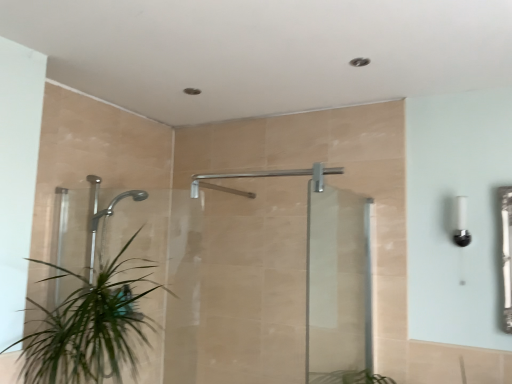
Locate an element on the screen. The width and height of the screenshot is (512, 384). transparent glass shower door at center, which ranks as the 2th screen door in right-to-left order is located at coordinates (268, 283).

Image resolution: width=512 pixels, height=384 pixels. Describe the element at coordinates (90, 327) in the screenshot. I see `green leafy plant at lower left` at that location.

I want to click on transparent glass screen door at center, arranged as the first screen door when viewed from the right, so click(338, 285).

Identify the location of white glossy light fixture at right. The image size is (512, 384). (461, 223).

Identify the location of houseplant below the transparent glass shower door at center, the first screen door from the left (from a real-world perspective). This screenshot has height=384, width=512. (90, 327).

How different are the orientations of transparent glass shower door at center, the first screen door from the left, and green leafy plant at lower left in degrees?

The angular difference between transparent glass shower door at center, the first screen door from the left, and green leafy plant at lower left is 85.4 degrees.

Are transparent glass shower door at center, which ranks as the 2th screen door in right-to-left order, and green leafy plant at lower left beside each other?

No.

Is silver metallic shower at center directly adjacent to white glossy light fixture at right?

No, silver metallic shower at center is not with white glossy light fixture at right.

You are a GUI agent. You are given a task and a screenshot of the screen. Output one action in this format:
    pyautogui.click(x=<x>, y=<y>)
    Task: Click on the shower above the white glossy light fixture at right (from a real-world perspective)
    This screenshot has height=384, width=512.
    Given the screenshot: What is the action you would take?
    [217, 189]

Is silver metallic shower at center located outside white glossy light fixture at right?

Indeed, silver metallic shower at center is completely outside white glossy light fixture at right.

Considering the sizes of objects silver metallic shower at center and white glossy light fixture at right in the image provided, who is taller, silver metallic shower at center or white glossy light fixture at right?

white glossy light fixture at right is taller.

Would you say white glossy light fixture at right is inside or outside transparent glass screen door at center, acting as the 2th screen door starting from the left?

white glossy light fixture at right is outside transparent glass screen door at center, acting as the 2th screen door starting from the left.

In the scene shown: Considering the sizes of objects white glossy light fixture at right and transparent glass screen door at center, arranged as the first screen door when viewed from the right, in the image provided, who is bigger, white glossy light fixture at right or transparent glass screen door at center, arranged as the first screen door when viewed from the right,?

Bigger between the two is transparent glass screen door at center, arranged as the first screen door when viewed from the right.

Does white glossy light fixture at right appear on the right side of transparent glass screen door at center, acting as the 2th screen door starting from the left?

Correct, you'll find white glossy light fixture at right to the right of transparent glass screen door at center, acting as the 2th screen door starting from the left.

Who is taller, white glossy light fixture at right or transparent glass screen door at center, acting as the 2th screen door starting from the left?

With more height is transparent glass screen door at center, acting as the 2th screen door starting from the left.

In terms of height, does white glossy light fixture at right look taller or shorter compared to transparent glass shower door at center, which ranks as the 2th screen door in right-to-left order?

white glossy light fixture at right is shorter than transparent glass shower door at center, which ranks as the 2th screen door in right-to-left order.

From the image's perspective, is white glossy light fixture at right positioned above or below transparent glass shower door at center, which ranks as the 2th screen door in right-to-left order?

From the image's perspective, white glossy light fixture at right appears above transparent glass shower door at center, which ranks as the 2th screen door in right-to-left order.

Would you consider white glossy light fixture at right to be distant from transparent glass shower door at center, which ranks as the 2th screen door in right-to-left order?

Absolutely, white glossy light fixture at right is distant from transparent glass shower door at center, which ranks as the 2th screen door in right-to-left order.

How much distance is there between white glossy light fixture at right and transparent glass shower door at center, which ranks as the 2th screen door in right-to-left order?

white glossy light fixture at right and transparent glass shower door at center, which ranks as the 2th screen door in right-to-left order, are 3.30 feet apart.

Is green leafy plant at lower left in front of or behind white glossy light fixture at right in the image?

green leafy plant at lower left is positioned closer to the viewer than white glossy light fixture at right.

From the image's perspective, is green leafy plant at lower left above white glossy light fixture at right?

No, from the image's perspective, green leafy plant at lower left is not over white glossy light fixture at right.

Can you confirm if green leafy plant at lower left is bigger than white glossy light fixture at right?

Yes, green leafy plant at lower left is bigger than white glossy light fixture at right.

Is green leafy plant at lower left facing away from white glossy light fixture at right?

No, green leafy plant at lower left's orientation is not away from white glossy light fixture at right.

Is transparent glass shower door at center, the first screen door from the left, not within transparent glass screen door at center, acting as the 2th screen door starting from the left?

Indeed, transparent glass shower door at center, the first screen door from the left, is completely outside transparent glass screen door at center, acting as the 2th screen door starting from the left.

Is transparent glass shower door at center, the first screen door from the left, at the left side of transparent glass screen door at center, arranged as the first screen door when viewed from the right?

Correct, you'll find transparent glass shower door at center, the first screen door from the left, to the left of transparent glass screen door at center, arranged as the first screen door when viewed from the right.

From a real-world perspective, relative to transparent glass screen door at center, acting as the 2th screen door starting from the left, is transparent glass shower door at center, the first screen door from the left, vertically above or below?

transparent glass shower door at center, the first screen door from the left, is above transparent glass screen door at center, acting as the 2th screen door starting from the left.

From the image's perspective, who appears lower, silver metallic shower at center or transparent glass shower door at center, which ranks as the 2th screen door in right-to-left order?

transparent glass shower door at center, which ranks as the 2th screen door in right-to-left order, appears lower in the image.

Is silver metallic shower at center positioned beyond the bounds of transparent glass shower door at center, the first screen door from the left?

Yes, silver metallic shower at center is not within transparent glass shower door at center, the first screen door from the left.

Relative to transparent glass shower door at center, which ranks as the 2th screen door in right-to-left order, is silver metallic shower at center in front or behind?

silver metallic shower at center is behind transparent glass shower door at center, which ranks as the 2th screen door in right-to-left order.

Who is taller, silver metallic shower at center or transparent glass shower door at center, the first screen door from the left?

Standing taller between the two is transparent glass shower door at center, the first screen door from the left.

The width and height of the screenshot is (512, 384). In order to click on houseplant lying on the left of transparent glass shower door at center, which ranks as the 2th screen door in right-to-left order in this screenshot , I will do `click(90, 327)`.

This screenshot has width=512, height=384. I want to click on light fixture lying on the right of silver metallic shower at center, so click(x=461, y=223).

Based on their spatial positions, is silver metallic shower at center or green leafy plant at lower left closer to white glossy light fixture at right?

silver metallic shower at center is closer to white glossy light fixture at right.

Based on their spatial positions, is white glossy light fixture at right or silver metallic shower at center further from transparent glass shower door at center, which ranks as the 2th screen door in right-to-left order?

Among the two, white glossy light fixture at right is located further to transparent glass shower door at center, which ranks as the 2th screen door in right-to-left order.

Based on the photo, looking at the image, which one is located closer to silver metallic shower at center, transparent glass shower door at center, which ranks as the 2th screen door in right-to-left order, or white glossy light fixture at right?

Among the two, transparent glass shower door at center, which ranks as the 2th screen door in right-to-left order, is located nearer to silver metallic shower at center.

In the scene shown: Estimate the real-world distances between objects in this image. Which object is further from green leafy plant at lower left, transparent glass screen door at center, arranged as the first screen door when viewed from the right, or silver metallic shower at center?

silver metallic shower at center is positioned further to the anchor green leafy plant at lower left.

Considering their positions, is transparent glass shower door at center, the first screen door from the left, positioned closer to green leafy plant at lower left than silver metallic shower at center?

Among the two, transparent glass shower door at center, the first screen door from the left, is located nearer to green leafy plant at lower left.

From the image, which object appears to be farther from green leafy plant at lower left, transparent glass shower door at center, which ranks as the 2th screen door in right-to-left order, or transparent glass screen door at center, acting as the 2th screen door starting from the left?

transparent glass screen door at center, acting as the 2th screen door starting from the left, is positioned further to the anchor green leafy plant at lower left.

Based on their spatial positions, is transparent glass screen door at center, acting as the 2th screen door starting from the left, or transparent glass shower door at center, which ranks as the 2th screen door in right-to-left order, closer to green leafy plant at lower left?

transparent glass shower door at center, which ranks as the 2th screen door in right-to-left order.

Estimate the real-world distances between objects in this image. Which object is closer to transparent glass shower door at center, the first screen door from the left, transparent glass screen door at center, acting as the 2th screen door starting from the left, or white glossy light fixture at right?

transparent glass screen door at center, acting as the 2th screen door starting from the left.

Locate an element on the screen. Image resolution: width=512 pixels, height=384 pixels. shower between transparent glass shower door at center, which ranks as the 2th screen door in right-to-left order, and white glossy light fixture at right from left to right is located at coordinates (217, 189).

Locate an element on the screen. shower located between green leafy plant at lower left and transparent glass screen door at center, acting as the 2th screen door starting from the left, in the left-right direction is located at coordinates (217, 189).

At what (x,y) coordinates should I click in order to perform the action: click on shower between transparent glass shower door at center, which ranks as the 2th screen door in right-to-left order, and transparent glass screen door at center, acting as the 2th screen door starting from the left. Please return your answer as a coordinate pair (x, y). Looking at the image, I should click on (217, 189).

The width and height of the screenshot is (512, 384). In order to click on shower located between green leafy plant at lower left and white glossy light fixture at right in the left-right direction in this screenshot , I will do `click(217, 189)`.